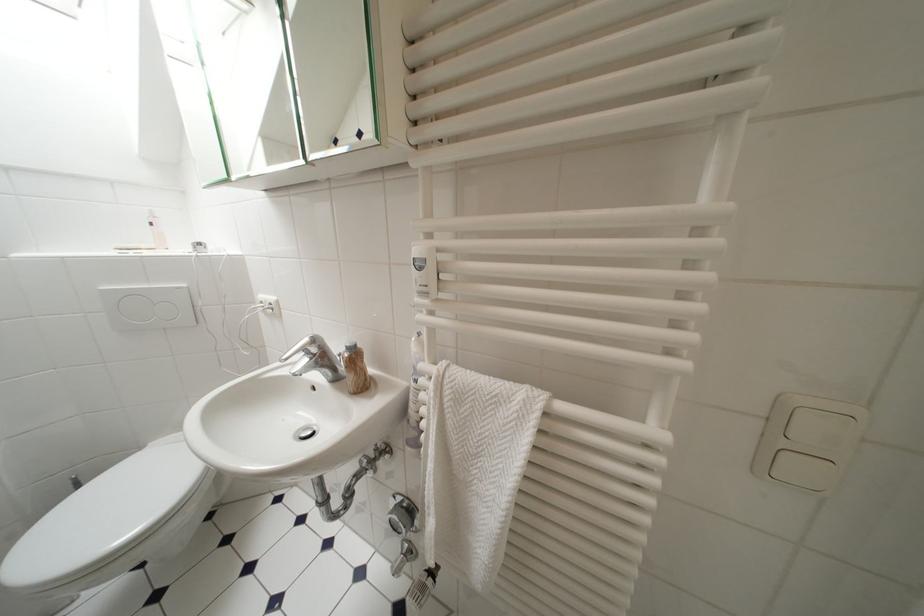
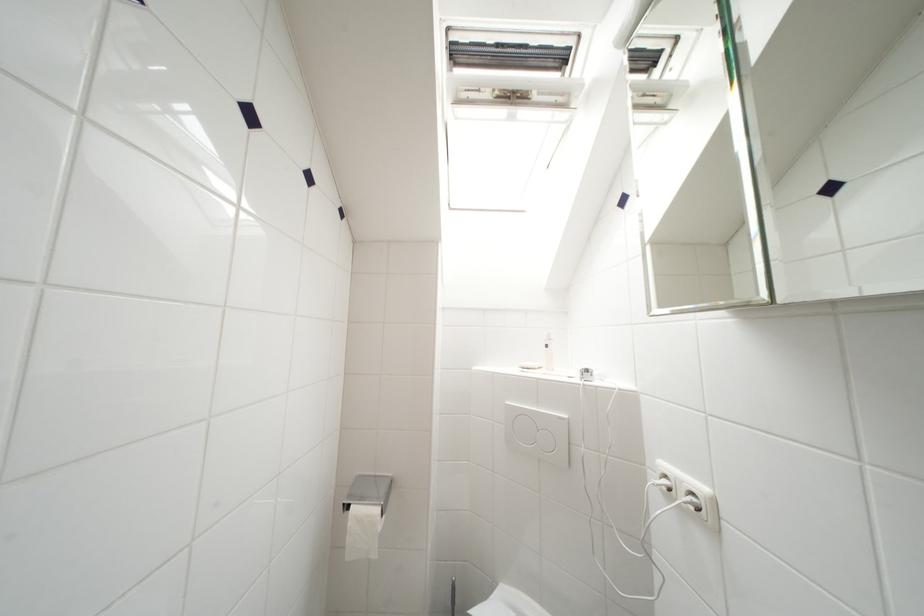
Question: The camera is either moving clockwise (left) or counter-clockwise (right) around the object. The first image is from the beginning of the video and the second image is from the end. Is the camera moving left or right when shooting the video?

Choices:
 (A) Left
 (B) Right

Answer: (B)